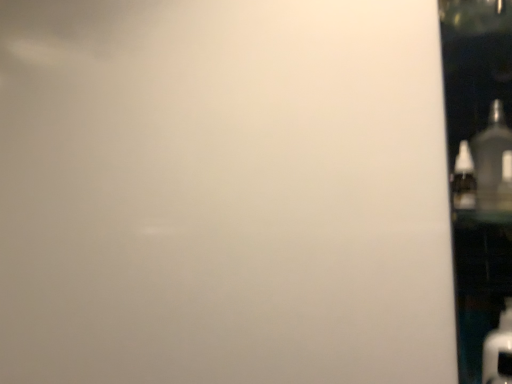
Question: Can you confirm if matte black bottle at right, the 2th bottle viewed from the left, is wider than transparent glass door at right?

Choices:
 (A) no
 (B) yes

Answer: (A)

Question: Is matte black bottle at right, the 2th bottle viewed from the left, not inside transparent glass door at right?

Choices:
 (A) yes
 (B) no

Answer: (B)

Question: Considering the relative sizes of matte black bottle at right, the 2th bottle viewed from the left, and transparent glass door at right in the image provided, is matte black bottle at right, the 2th bottle viewed from the left, bigger than transparent glass door at right?

Choices:
 (A) yes
 (B) no

Answer: (B)

Question: Is transparent glass door at right a part of matte black bottle at right, placed as the 1th bottle when sorted from right to left?

Choices:
 (A) no
 (B) yes

Answer: (A)

Question: Is matte black bottle at right, the 2th bottle viewed from the left, to the left of transparent glass door at right from the viewer's perspective?

Choices:
 (A) yes
 (B) no

Answer: (A)

Question: Can you confirm if matte black bottle at right, the 2th bottle viewed from the left, is smaller than transparent glass door at right?

Choices:
 (A) no
 (B) yes

Answer: (B)

Question: From the image's perspective, does transparent glass door at right appear higher than matte black bottle at right, placed as the 1th bottle when sorted from right to left?

Choices:
 (A) yes
 (B) no

Answer: (B)

Question: Is matte black bottle at right, the 2th bottle viewed from the left, surrounded by transparent glass door at right?

Choices:
 (A) yes
 (B) no

Answer: (A)

Question: Considering the relative sizes of transparent glass door at right and matte black bottle at right, the 2th bottle viewed from the left, in the image provided, is transparent glass door at right bigger than matte black bottle at right, the 2th bottle viewed from the left,?

Choices:
 (A) no
 (B) yes

Answer: (B)

Question: Can you confirm if transparent glass door at right is smaller than matte black bottle at right, the 2th bottle viewed from the left?

Choices:
 (A) no
 (B) yes

Answer: (A)

Question: Is transparent glass door at right wider than matte black bottle at right, the 2th bottle viewed from the left?

Choices:
 (A) no
 (B) yes

Answer: (B)

Question: Is transparent glass door at right facing away from matte black bottle at right, placed as the 1th bottle when sorted from right to left?

Choices:
 (A) yes
 (B) no

Answer: (A)

Question: Is clear plastic bottle at right, which is counted as the 2th bottle, starting from the right, shorter than transparent glass door at right?

Choices:
 (A) no
 (B) yes

Answer: (B)